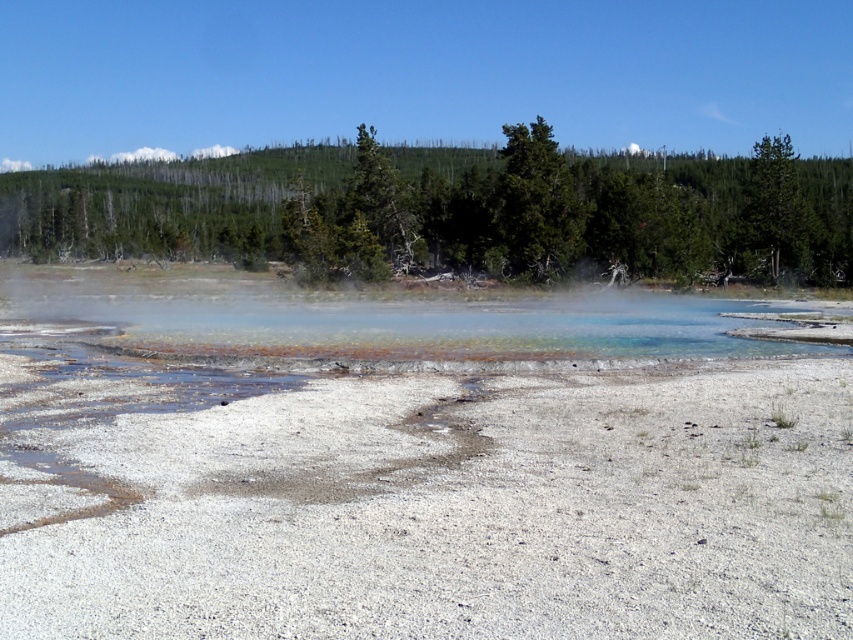
You are a hiker who just arrived at this geothermal area and want to reach the green leafy tree at upper center. Given that you can walk at a normal pace of 3 miles per hour, how long would it take you to reach the tree?

The green leafy tree at upper center is 207.30 feet away. Converting feet to miles, 207.30 feet is approximately 0.039 miles. At a walking speed of 3 miles per hour, the time required would be distance divided by speed, so 0.039 miles divided by 3 mph equals approximately 0.013 hours. Converting hours to minutes, 0.013 hours multiplied by 60 minutes equals about 0.78 minutes, which is roughly 47 seconds. Therefore, it would take approximately 47 seconds to reach the green leafy tree at upper center.

Looking at this image, you are a hiker standing at the edge of the geothermal area and see the green leafy tree at upper center and the green matte tree at upper right. Which tree is positioned higher in the image?

The green leafy tree at upper center is positioned higher in the image than the green matte tree at upper right.

You are a hiker who wants to cross the translucent mineral water at center to reach a viewpoint behind it. However, there is a green leafy tree at upper center blocking your path. Can you walk around the tree to access the water?

The translucent mineral water at center is behind the green leafy tree at upper center, so you cannot walk around the tree to access the water directly. You would need to find another route or path that goes around both the tree and the water.